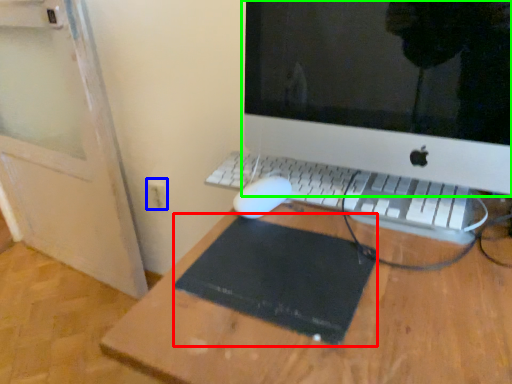
Question: Based on their relative distances, which object is nearer to mousepad (highlighted by a red box)? Choose from electric outlet (highlighted by a blue box) and computer monitor (highlighted by a green box).

Choices:
 (A) electric outlet
 (B) computer monitor

Answer: (A)